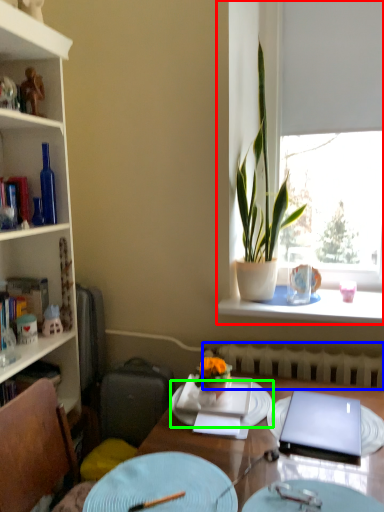
Question: Which is nearer to the window (highlighted by a red box)? radiator (highlighted by a blue box) or plate (highlighted by a green box).

Choices:
 (A) radiator
 (B) plate

Answer: (A)